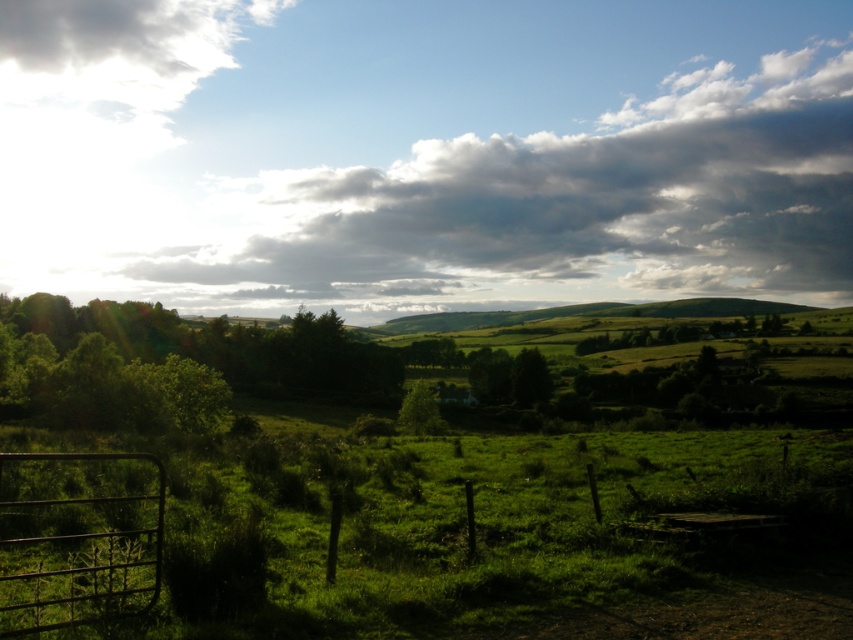
You are standing in the middle of the green field bordered by the wire fence. You notice the white fluffy cloud at upper center and the green leafy tree at center. Which object appears taller from your perspective?

The white fluffy cloud at upper center appears taller than the green leafy tree at center because it has a greater height compared to it.

You are standing in a rural landscape and want to walk to the point marked at coordinates point (62, 620). How far will you have to walk to reach that point?

The distance between you and the point (62, 620) is 6.51 meters, so you will have to walk 6.51 meters to reach it.

Looking at this image, you are planning to paint the scene, and you want to ensure the proportions between the white fluffy cloud at upper center and the rusty metal gate at lower left are accurate. Which one should you paint larger?

The white fluffy cloud at upper center should be painted larger since it is larger in size than the rusty metal gate at lower left according to the description.